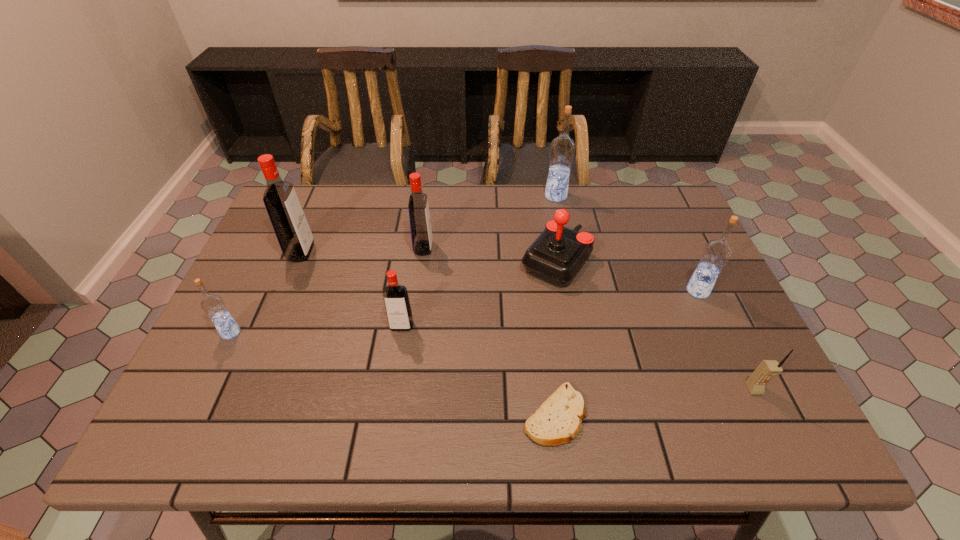
The height and width of the screenshot is (540, 960). I want to click on empty space that is in between the leftmost red vodka and the shortest object, so click(x=427, y=334).

Image resolution: width=960 pixels, height=540 pixels. In order to click on object that is the eighth closest to the leftmost vodka in this screenshot , I will do `click(766, 369)`.

What are the coordinates of `object identified as the third closest to the shortest object` in the screenshot? It's located at (766, 369).

Locate which vodka ranks in proximity to the red joystick. Please provide its 2D coordinates. Your answer should be formatted as a tuple, i.e. [(x, y)], where the tuple contains the x and y coordinates of a point satisfying the conditions above.

[(562, 148)]

The image size is (960, 540). In order to click on vodka that is the third closest one to the biggest red vodka in this screenshot , I will do `click(398, 309)`.

Where is `blue vodka that is the closest to the joystick`? The height and width of the screenshot is (540, 960). blue vodka that is the closest to the joystick is located at coordinates (562, 148).

This screenshot has height=540, width=960. In order to click on blue vodka that is the closest to the biggest red vodka in this screenshot , I will do `click(213, 305)`.

Point out which red vodka is positioned as the nearest to the farthest vodka. Please provide its 2D coordinates. Your answer should be formatted as a tuple, i.e. [(x, y)], where the tuple contains the x and y coordinates of a point satisfying the conditions above.

[(420, 224)]

The width and height of the screenshot is (960, 540). Find the location of `the closest red vodka to the second vodka from right to left`. the closest red vodka to the second vodka from right to left is located at coordinates (420, 224).

The width and height of the screenshot is (960, 540). Identify the location of vacant area in the image that satisfies the following two spatial constraints: 1. on the front and back of the second biggest red vodka; 2. on the front and back of the smallest red vodka. coord(413,326).